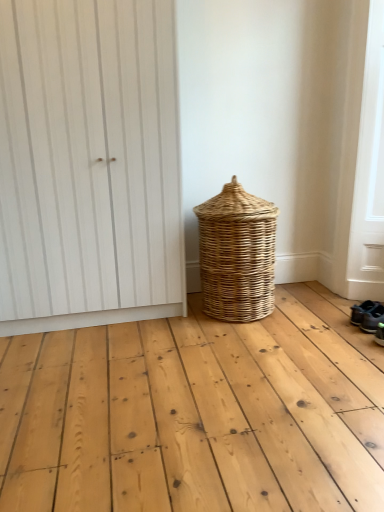
Question: Could you tell me if dark blue fabric sneakers at lower right, acting as the 1th footwear starting from the back, is turned towards dark gray fabric shoe at lower right, marked as the second footwear in a back-to-front arrangement?

Choices:
 (A) yes
 (B) no

Answer: (B)

Question: Is dark blue fabric sneakers at lower right, the 2th footwear when ordered from front to back, to the left of dark gray fabric shoe at lower right, the first footwear from the front, from the viewer's perspective?

Choices:
 (A) no
 (B) yes

Answer: (B)

Question: From the image's perspective, is dark blue fabric sneakers at lower right, acting as the 1th footwear starting from the back, located above dark gray fabric shoe at lower right, marked as the second footwear in a back-to-front arrangement?

Choices:
 (A) yes
 (B) no

Answer: (A)

Question: Considering the relative sizes of dark blue fabric sneakers at lower right, the 2th footwear when ordered from front to back, and dark gray fabric shoe at lower right, the first footwear from the front, in the image provided, is dark blue fabric sneakers at lower right, the 2th footwear when ordered from front to back, taller than dark gray fabric shoe at lower right, the first footwear from the front,?

Choices:
 (A) no
 (B) yes

Answer: (B)

Question: Does dark blue fabric sneakers at lower right, the 2th footwear when ordered from front to back, come in front of dark gray fabric shoe at lower right, the first footwear from the front?

Choices:
 (A) no
 (B) yes

Answer: (A)

Question: From the image's perspective, is dark blue fabric sneakers at lower right, the 2th footwear when ordered from front to back, below dark gray fabric shoe at lower right, the first footwear from the front?

Choices:
 (A) no
 (B) yes

Answer: (A)

Question: From a real-world perspective, is dark blue fabric sneakers at lower right, the 2th footwear when ordered from front to back, positioned under white wood door at upper left based on gravity?

Choices:
 (A) no
 (B) yes

Answer: (B)

Question: Considering the relative sizes of dark blue fabric sneakers at lower right, acting as the 1th footwear starting from the back, and white wood door at upper left in the image provided, is dark blue fabric sneakers at lower right, acting as the 1th footwear starting from the back, shorter than white wood door at upper left?

Choices:
 (A) yes
 (B) no

Answer: (A)

Question: Is dark blue fabric sneakers at lower right, acting as the 1th footwear starting from the back, located outside white wood door at upper left?

Choices:
 (A) yes
 (B) no

Answer: (A)

Question: Can you confirm if dark blue fabric sneakers at lower right, acting as the 1th footwear starting from the back, is smaller than white wood door at upper left?

Choices:
 (A) yes
 (B) no

Answer: (A)

Question: Is dark blue fabric sneakers at lower right, the 2th footwear when ordered from front to back, behind white wood door at upper left?

Choices:
 (A) no
 (B) yes

Answer: (B)

Question: Considering the relative sizes of dark blue fabric sneakers at lower right, acting as the 1th footwear starting from the back, and white wood door at upper left in the image provided, is dark blue fabric sneakers at lower right, acting as the 1th footwear starting from the back, bigger than white wood door at upper left?

Choices:
 (A) no
 (B) yes

Answer: (A)

Question: Is white wood door at upper left positioned behind dark gray fabric shoe at lower right, the first footwear from the front?

Choices:
 (A) yes
 (B) no

Answer: (B)